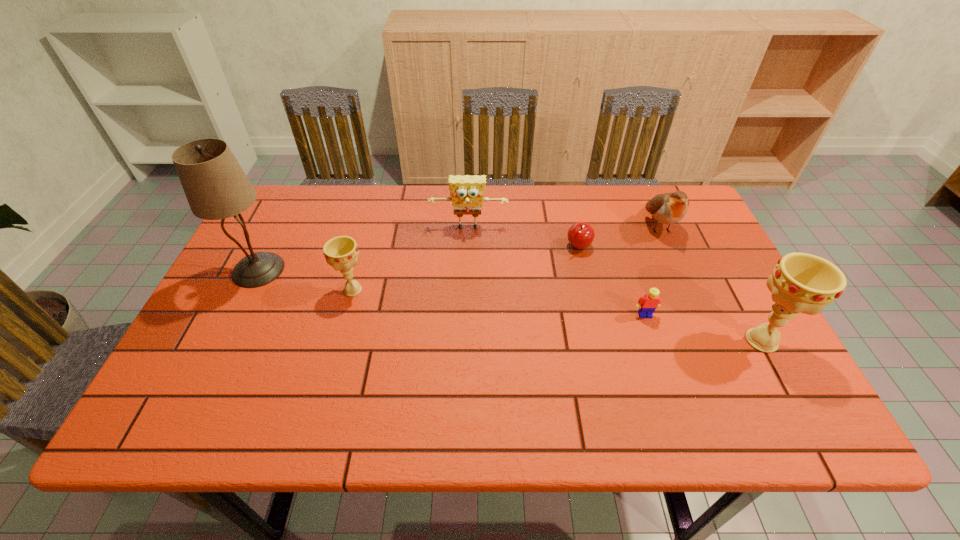
Identify the location of free space at the near left corner of the desktop. (199, 369).

This screenshot has height=540, width=960. In order to click on free space that is in between the third object from right to left and the fourth object from right to left in this screenshot , I will do `click(612, 280)`.

Identify the location of empty space that is in between the bird and the cherry. (618, 236).

Identify the location of empty location between the second object from right to left and the leftmost object. Image resolution: width=960 pixels, height=540 pixels. (459, 248).

You are a GUI agent. You are given a task and a screenshot of the screen. Output one action in this format:
    pyautogui.click(x=<x>, y=<y>)
    Task: Click on the vacant region between the second tallest object and the fifth object from right to left
    Image resolution: width=960 pixels, height=540 pixels.
    Given the screenshot: What is the action you would take?
    pyautogui.click(x=615, y=285)

Where is `free space between the sixth object from right to left and the sixth object from left to right`? free space between the sixth object from right to left and the sixth object from left to right is located at coordinates (506, 258).

Locate an element on the screen. This screenshot has width=960, height=540. free space between the lampshade and the fourth object from left to right is located at coordinates (419, 258).

Identify the location of free space between the shorter chalice and the third object from left to right. The width and height of the screenshot is (960, 540). (411, 259).

Image resolution: width=960 pixels, height=540 pixels. In order to click on blank region between the sixth object from left to right and the fifth object from right to left in this screenshot , I will do `click(564, 227)`.

At what (x,y) coordinates should I click in order to perform the action: click on unoccupied area between the third object from left to right and the left chalice. Please return your answer as a coordinate pair (x, y). Looking at the image, I should click on (411, 259).